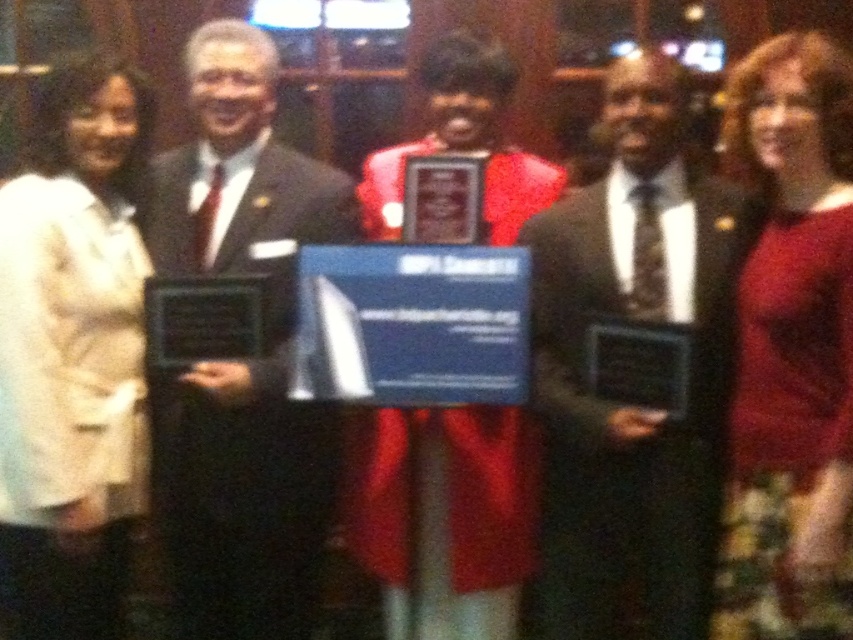
Is point (238, 104) positioned after point (802, 362)?

Yes, point (238, 104) is behind point (802, 362).

You are a GUI agent. You are given a task and a screenshot of the screen. Output one action in this format:
    pyautogui.click(x=<x>, y=<y>)
    Task: Click on the matte black suit at center
    The width and height of the screenshot is (853, 640).
    Given the screenshot: What is the action you would take?
    pyautogui.click(x=245, y=499)

Where is `matte black suit at center`? matte black suit at center is located at coordinates (245, 499).

Which is behind, point (553, 330) or point (32, 540)?

The point (553, 330) is more distant.

Is point (699, 368) closer to viewer compared to point (26, 186)?

Yes.

Where is `shiny black suit at center`? The height and width of the screenshot is (640, 853). shiny black suit at center is located at coordinates pyautogui.click(x=631, y=400).

Who is positioned more to the right, white fabric coat at left or red sweater at right?

red sweater at right is more to the right.

Is point (90, 449) in front of point (762, 161)?

Yes, it is.

Image resolution: width=853 pixels, height=640 pixels. Identify the location of white fabric coat at left. (73, 355).